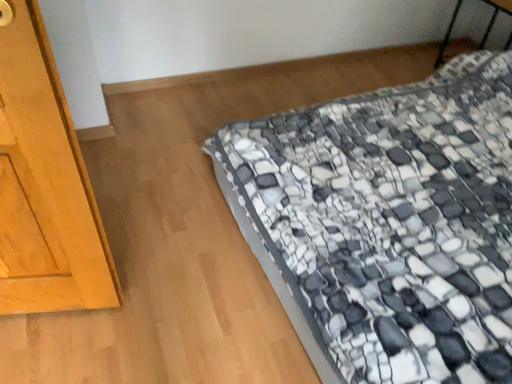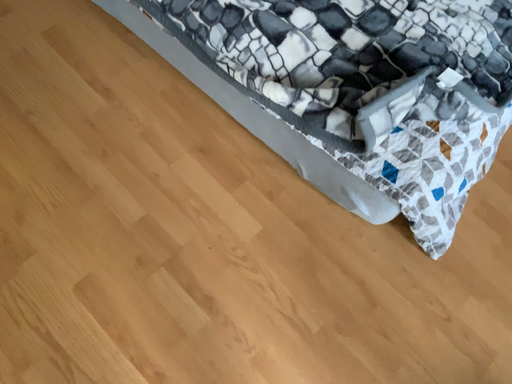
Question: How did the camera likely rotate when shooting the video?

Choices:
 (A) rotated right
 (B) rotated left

Answer: (A)